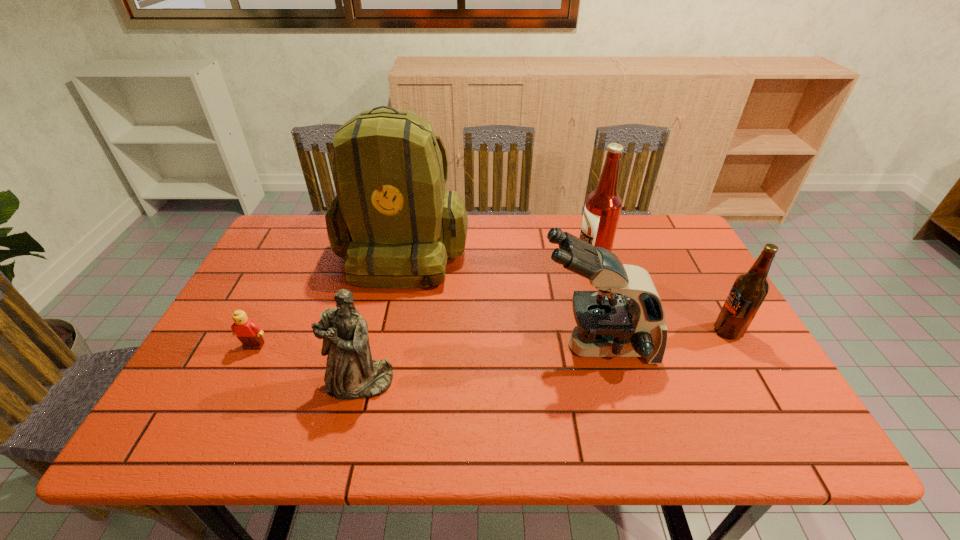
The height and width of the screenshot is (540, 960). In order to click on backpack in this screenshot , I will do `click(392, 220)`.

Image resolution: width=960 pixels, height=540 pixels. I want to click on alcohol, so click(603, 206).

Where is `microscope`? Image resolution: width=960 pixels, height=540 pixels. microscope is located at coordinates (609, 324).

You are a GUI agent. You are given a task and a screenshot of the screen. Output one action in this format:
    pyautogui.click(x=<x>, y=<y>)
    Task: Click on the rightmost object
    
    Given the screenshot: What is the action you would take?
    pyautogui.click(x=749, y=290)

Locate an element on the screen. Image resolution: width=960 pixels, height=540 pixels. figurine is located at coordinates (351, 374).

At what (x,y) coordinates should I click in order to perform the action: click on Lego. Please return your answer as a coordinate pair (x, y). Looking at the image, I should click on (249, 333).

Locate an element on the screen. the shortest object is located at coordinates (249, 333).

Identify the location of vacant area situated on the front-facing side of the backpack. This screenshot has width=960, height=540. (376, 377).

At what (x,y) coordinates should I click in order to perform the action: click on vacant point located 0.310m on the label side of the alcohol. Please return your answer as a coordinate pair (x, y). Looking at the image, I should click on tap(472, 261).

Identify the location of free space located 0.200m on the label side of the alcohol. (509, 261).